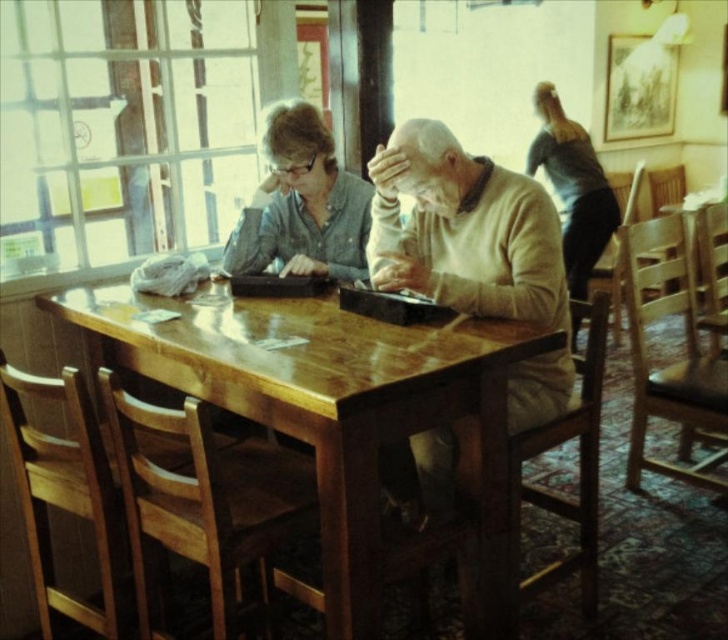
You are a customer at the cafe and want to place your coffee mug on the table. The light beige sweater at center and the dark gray sweater at upper right are both on the table. Which sweater can you move to make more space for your mug?

The light beige sweater at center occupies less space than the dark gray sweater at upper right, so moving the dark gray sweater at upper right would free up more space for your mug.